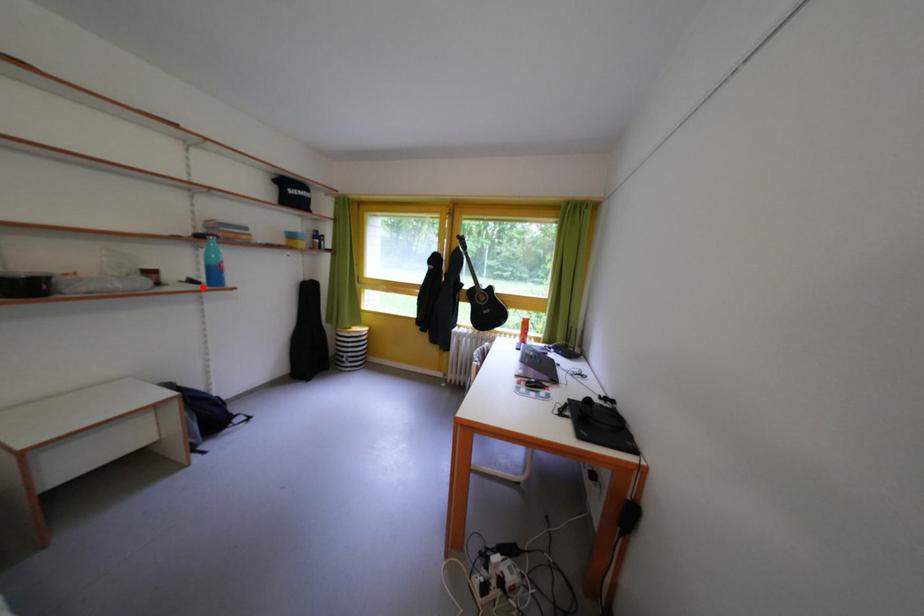
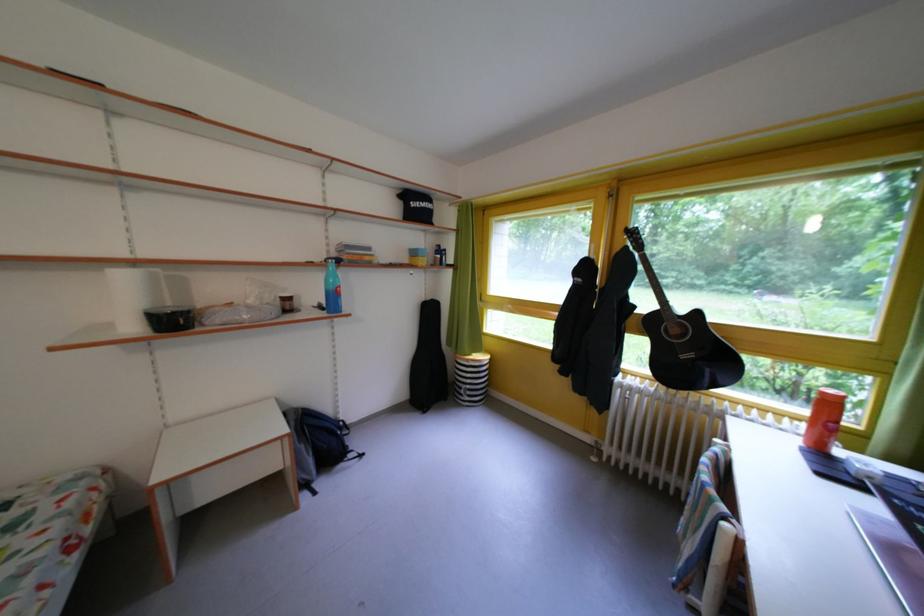
Locate, in the second image, the point that corresponds to the highlighted location in the first image.

(331, 313)